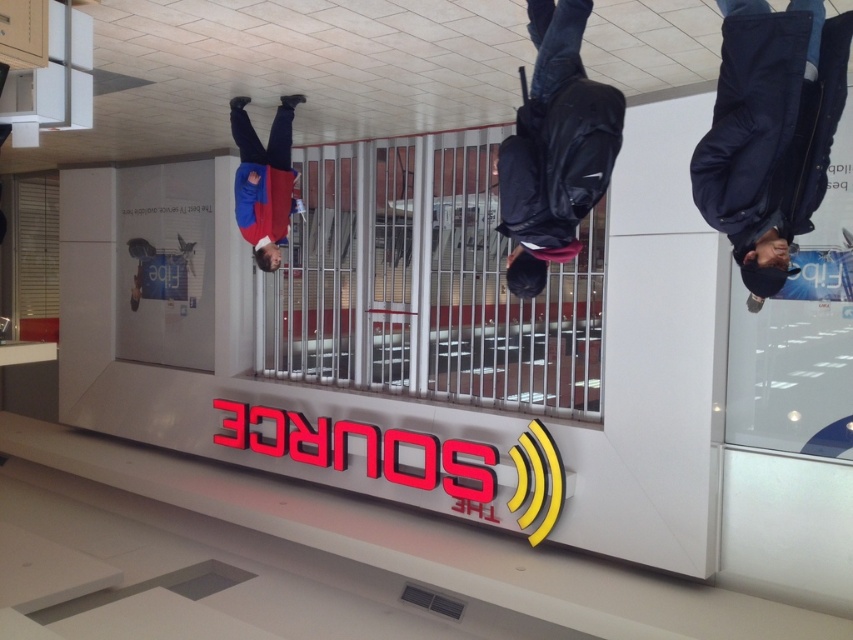
This screenshot has width=853, height=640. What are the coordinates of `dark blue backpack at center` in the screenshot? It's located at (555, 147).

Looking at this image, does dark blue backpack at center have a smaller size compared to blue fabric jacket at upper center?

Yes, dark blue backpack at center is smaller than blue fabric jacket at upper center.

Between point (561, 150) and point (262, 177), which one is positioned behind?

Point (262, 177)

Find the location of a particular element. The width and height of the screenshot is (853, 640). dark blue backpack at center is located at coordinates (555, 147).

Which is above, dark blue jacket at center or dark blue backpack at center?

dark blue backpack at center

Is dark blue jacket at center further to the viewer compared to dark blue backpack at center?

That is False.

Find the location of a particular element. dark blue jacket at center is located at coordinates (770, 131).

What do you see at coordinates (770, 131) in the screenshot? I see `dark blue jacket at center` at bounding box center [770, 131].

Measure the distance from dark blue jacket at center to blue fabric jacket at upper center.

They are 10.68 feet apart.

Find the location of a particular element. The image size is (853, 640). dark blue jacket at center is located at coordinates (770, 131).

You are a GUI agent. You are given a task and a screenshot of the screen. Output one action in this format:
    pyautogui.click(x=<x>, y=<y>)
    Task: Click on the dark blue jacket at center
    This screenshot has width=853, height=640.
    Given the screenshot: What is the action you would take?
    pyautogui.click(x=770, y=131)